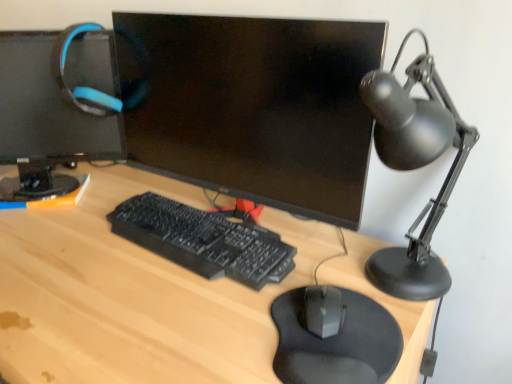
The width and height of the screenshot is (512, 384). I want to click on free space behind black matte mouse at center, so click(x=326, y=262).